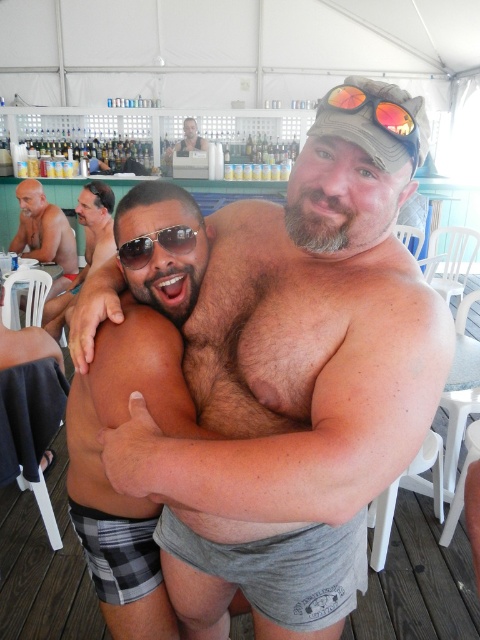
Which is more to the left, gray fabric shorts at center or reflective plastic goggles at upper center?

gray fabric shorts at center is more to the left.

Is gray fabric shorts at center taller than reflective plastic goggles at upper center?

Indeed, gray fabric shorts at center has a greater height compared to reflective plastic goggles at upper center.

The image size is (480, 640). I want to click on gray fabric shorts at center, so click(296, 387).

Can you confirm if bald head at left is wider than smooth skin man at center?

Correct, the width of bald head at left exceeds that of smooth skin man at center.

Does bald head at left appear over smooth skin man at center?

No, bald head at left is not above smooth skin man at center.

The height and width of the screenshot is (640, 480). Identify the location of bald head at left. pos(45,234).

Does point (86, 259) come in front of point (137, 256)?

No, it is not.

Can you confirm if beige plaid shorts at left is taller than sunglasses at center?

Correct, beige plaid shorts at left is much taller as sunglasses at center.

Between point (85, 208) and point (122, 257), which one is positioned behind?

The point (85, 208) is more distant.

Locate an element on the screen. beige plaid shorts at left is located at coordinates (84, 248).